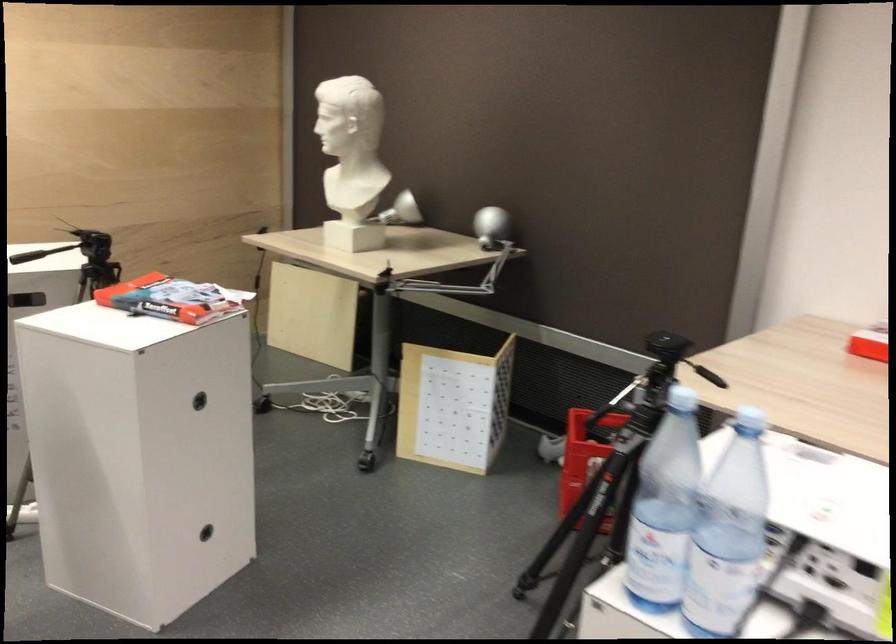
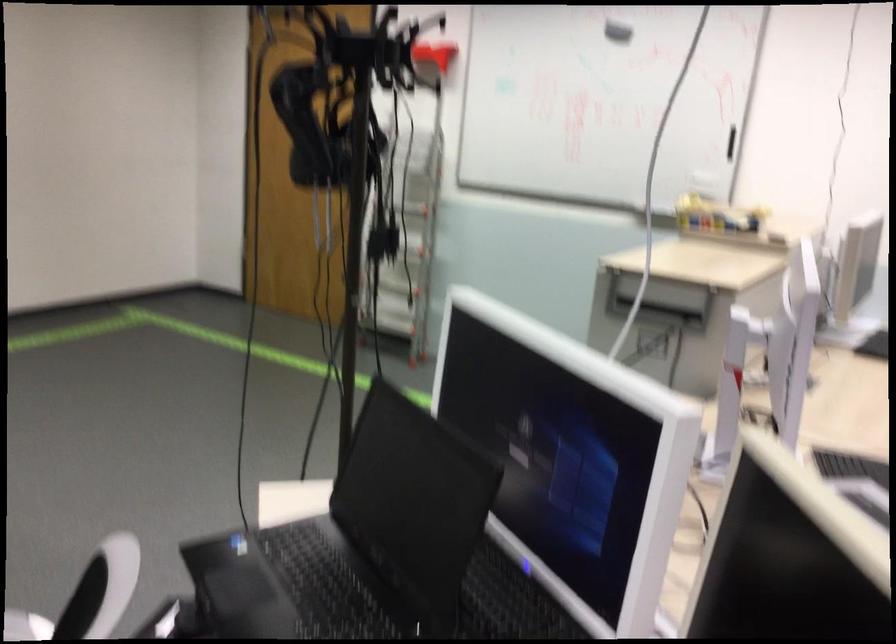
Question: Based on the continuous images, in which direction is the camera rotating? Reply with the corresponding letter.

Choices:
 (A) Left
 (B) Right
 (C) Up
 (D) Down

Answer: (A)